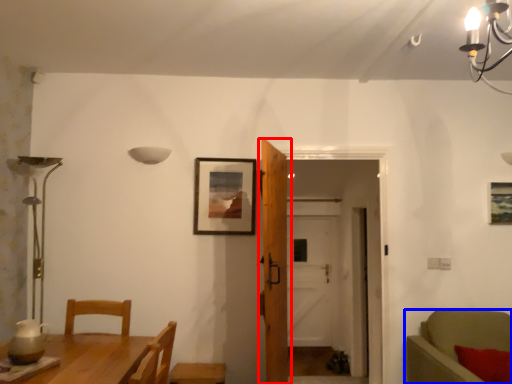
Question: Which object appears farthest to the camera in this image, door (highlighted by a red box) or chair (highlighted by a blue box)?

Choices:
 (A) door
 (B) chair

Answer: (A)